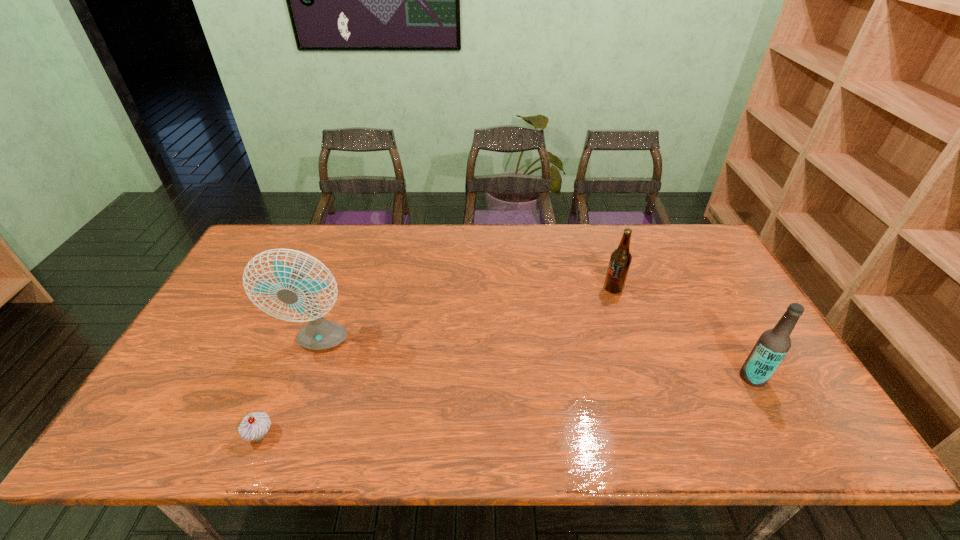
Identify the location of free location at the left edge. (170, 390).

Where is `free region at the right edge of the desktop`? This screenshot has width=960, height=540. free region at the right edge of the desktop is located at coordinates (779, 394).

Image resolution: width=960 pixels, height=540 pixels. I want to click on free region at the near left corner, so click(168, 427).

Identify the location of free space at the far right corner. This screenshot has height=540, width=960. (692, 237).

I want to click on free space between the shortest object and the farthest object, so click(437, 362).

Identify the location of vacant area between the cupcake and the second farthest object. (290, 389).

Locate an element on the screen. The width and height of the screenshot is (960, 540). free space between the farther beer bottle and the fan is located at coordinates (467, 316).

Where is `free space between the nearest object and the farther beer bottle`? The image size is (960, 540). free space between the nearest object and the farther beer bottle is located at coordinates (437, 362).

This screenshot has width=960, height=540. In order to click on vacant area that lies between the tallest object and the cupcake in this screenshot , I will do `click(290, 389)`.

At what (x,y) coordinates should I click in order to perform the action: click on vacant space that's between the tallest object and the cupcake. Please return your answer as a coordinate pair (x, y). Looking at the image, I should click on (290, 389).